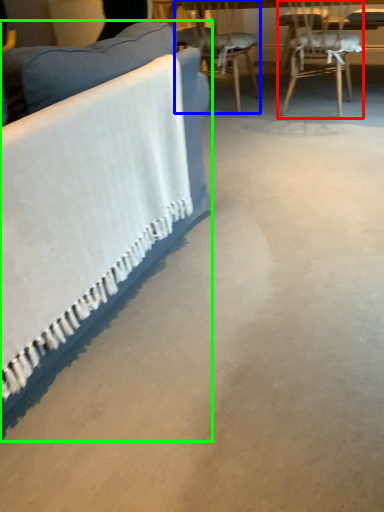
Question: Which object is the farthest from chair (highlighted by a red box)? Choose among these: chair (highlighted by a blue box) or studio couch (highlighted by a green box).

Choices:
 (A) chair
 (B) studio couch

Answer: (B)